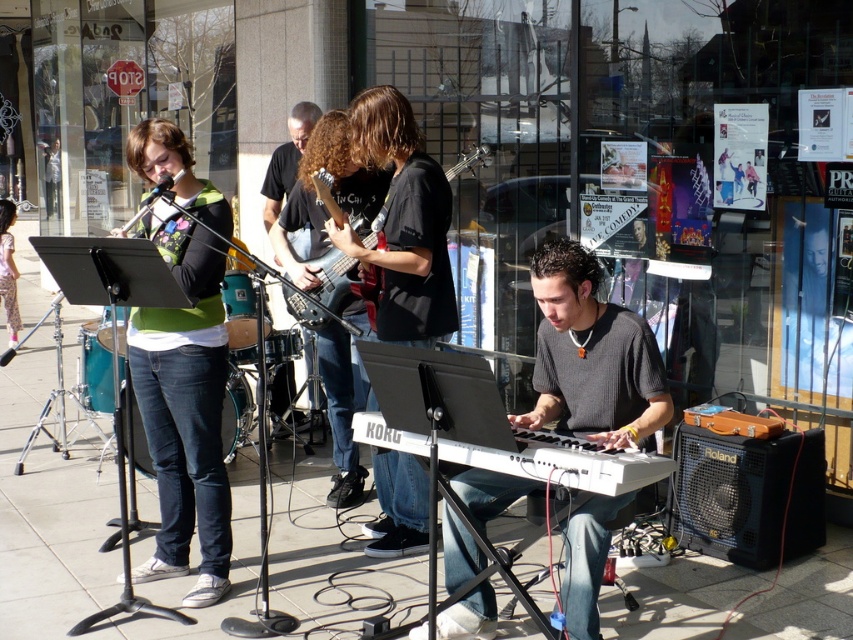
Question: Which point is closer to the camera?

Choices:
 (A) tap(569, 468)
 (B) tap(425, 230)
 (C) tap(289, 401)
 (D) tap(585, 355)

Answer: (A)

Question: Which point appears closest to the camera in this image?

Choices:
 (A) (479, 147)
 (B) (543, 330)
 (C) (189, 406)

Answer: (B)

Question: Is gray knitted sweater at center below white plastic keyboard at center?

Choices:
 (A) no
 (B) yes

Answer: (B)

Question: Which of these objects is positioned farthest from the denim jeans at lower left?

Choices:
 (A) white plastic keyboard at center
 (B) gray knitted sweater at center
 (C) black cotton shirt at center

Answer: (A)

Question: Is black fabric guitar at center to the right of metallic electric guitar at center from the viewer's perspective?

Choices:
 (A) yes
 (B) no

Answer: (B)

Question: Observing the image, what is the correct spatial positioning of gray knitted sweater at center in reference to white plastic keyboard at center?

Choices:
 (A) above
 (B) below

Answer: (B)